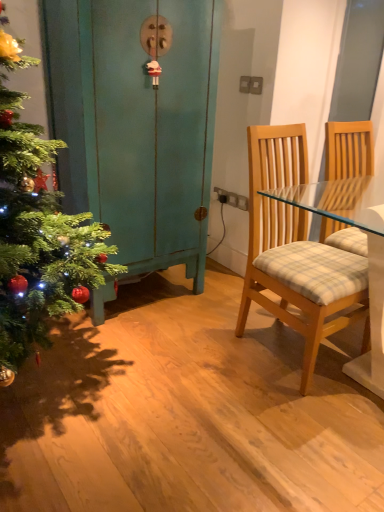
In order to click on free space between teal painted wood dresser at left and light wood/glass chair at right in this screenshot , I will do `click(197, 331)`.